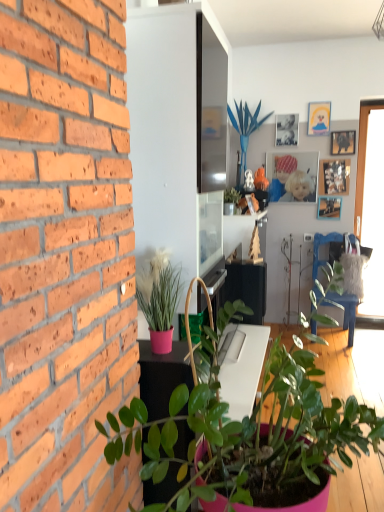
Find the location of a particular element. This screenshot has height=512, width=384. green matte plant at lower center, the first houseplant in the front-to-back sequence is located at coordinates (247, 432).

Measure the distance between green matte plant at lower center, the first houseplant in the front-to-back sequence, and camera.

They are 3.48 feet apart.

How much space does wooden picture frame at upper center, the 4th picture frame positioned from the top, occupy vertically?

The height of wooden picture frame at upper center, the 4th picture frame positioned from the top, is 19.75 inches.

The height and width of the screenshot is (512, 384). What do you see at coordinates (245, 127) in the screenshot?
I see `blue artificial plant at center, placed as the first houseplant when sorted from top to bottom` at bounding box center [245, 127].

Find the location of a particular element. wooden picture frame at upper right, the fourth picture frame in the bottom-to-top sequence is located at coordinates (343, 142).

Where is `green matte plant at lower center, which is the 4th houseplant from back to front`? green matte plant at lower center, which is the 4th houseplant from back to front is located at coordinates (247, 432).

Between wooden picture frame at upper right, the fourth picture frame in the bottom-to-top sequence, and pink matte plant at left, the 2th houseplant when ordered from bottom to top, which one appears on the right side from the viewer's perspective?

wooden picture frame at upper right, the fourth picture frame in the bottom-to-top sequence.

From the picture: Which of these two, wooden picture frame at upper right, the fourth picture frame in the bottom-to-top sequence, or pink matte plant at left, which is the 3th houseplant from back to front, stands shorter?

Standing shorter between the two is wooden picture frame at upper right, the fourth picture frame in the bottom-to-top sequence.

Which object is thinner, wooden picture frame at upper right, which is the third picture frame in top-to-bottom order, or pink matte plant at left, the 3th houseplant from the top?

wooden picture frame at upper right, which is the third picture frame in top-to-bottom order.

From the image's perspective, starting from the pink matte plant at left, which is the 3th houseplant from back to front, which picture frame is the 4th one above? Please provide its 2D coordinates.

[(343, 142)]

Is blue artificial plant at center, acting as the 1th houseplant starting from the back, facing away from matte wooden picture frame at upper right, which is the first picture frame in top-to-bottom order?

No, matte wooden picture frame at upper right, which is the first picture frame in top-to-bottom order, is not at the back of blue artificial plant at center, acting as the 1th houseplant starting from the back.

From the blue artificial plant at center, placed as the first houseplant when sorted from top to bottom, count 2nd picture frames backward and point to it. Please provide its 2D coordinates.

[(319, 118)]

Are blue artificial plant at center, positioned as the fourth houseplant in front-to-back order, and matte wooden picture frame at upper right, the sixth picture frame in the bottom-to-top sequence, far apart?

No.

From the image's perspective, who appears lower, blue artificial plant at center, which appears as the fourth houseplant when ordered from the bottom, or matte wooden picture frame at upper right, the sixth picture frame in the bottom-to-top sequence?

blue artificial plant at center, which appears as the fourth houseplant when ordered from the bottom, is shown below in the image.

How distant is wooden picture frame at upper right, the fourth picture frame in the bottom-to-top sequence, from wooden picture frame at upper center, the 4th picture frame positioned from the top?

wooden picture frame at upper right, the fourth picture frame in the bottom-to-top sequence, is 16.34 inches from wooden picture frame at upper center, the 4th picture frame positioned from the top.

What's the angular difference between wooden picture frame at upper right, the fourth picture frame in the bottom-to-top sequence, and wooden picture frame at upper center, the 4th picture frame positioned from the top,'s facing directions?

0.845 degrees separate the facing orientations of wooden picture frame at upper right, the fourth picture frame in the bottom-to-top sequence, and wooden picture frame at upper center, the 4th picture frame positioned from the top.

Considering the points (354, 143) and (273, 168), which point is behind, point (354, 143) or point (273, 168)?

The point (273, 168) is farther from the camera.

Considering the relative positions of wooden picture frame at upper right, which is the third picture frame in top-to-bottom order, and wooden picture frame at upper center, the 4th picture frame positioned from the top, in the image provided, is wooden picture frame at upper right, which is the third picture frame in top-to-bottom order, to the right of wooden picture frame at upper center, the 4th picture frame positioned from the top, from the viewer's perspective?

Correct, you'll find wooden picture frame at upper right, which is the third picture frame in top-to-bottom order, to the right of wooden picture frame at upper center, the 4th picture frame positioned from the top.

Which picture frame is the 2nd one when counting from the right side of the blue artificial plant at center, placed as the first houseplant when sorted from top to bottom? Please provide its 2D coordinates.

[(292, 176)]

Can you confirm if wooden picture frame at upper center, which is the third picture frame from bottom to top, is wider than blue artificial plant at center, which appears as the fourth houseplant when ordered from the bottom?

In fact, wooden picture frame at upper center, which is the third picture frame from bottom to top, might be narrower than blue artificial plant at center, which appears as the fourth houseplant when ordered from the bottom.

Is wooden picture frame at upper center, which is the third picture frame from bottom to top, oriented towards blue artificial plant at center, positioned as the fourth houseplant in front-to-back order?

No, wooden picture frame at upper center, which is the third picture frame from bottom to top, is not facing towards blue artificial plant at center, positioned as the fourth houseplant in front-to-back order.

Considering their positions, is wooden picture frame at upper center, which is the third picture frame from bottom to top, located in front of or behind blue artificial plant at center, positioned as the fourth houseplant in front-to-back order?

wooden picture frame at upper center, which is the third picture frame from bottom to top, is positioned farther from the viewer than blue artificial plant at center, positioned as the fourth houseplant in front-to-back order.

From the picture: Is green glossy plant at upper center, positioned as the second houseplant in top-to-bottom order, completely or partially outside of blue artificial plant at center, acting as the 1th houseplant starting from the back?

green glossy plant at upper center, positioned as the second houseplant in top-to-bottom order, is positioned outside blue artificial plant at center, acting as the 1th houseplant starting from the back.

Which of these two, green glossy plant at upper center, positioned as the second houseplant in top-to-bottom order, or blue artificial plant at center, placed as the first houseplant when sorted from top to bottom, is thinner?

green glossy plant at upper center, positioned as the second houseplant in top-to-bottom order.

Considering the sizes of objects green glossy plant at upper center, which ranks as the 3th houseplant in bottom-to-top order, and blue artificial plant at center, positioned as the fourth houseplant in front-to-back order, in the image provided, who is bigger, green glossy plant at upper center, which ranks as the 3th houseplant in bottom-to-top order, or blue artificial plant at center, positioned as the fourth houseplant in front-to-back order,?

blue artificial plant at center, positioned as the fourth houseplant in front-to-back order, is bigger.

From a real-world perspective, between green glossy plant at upper center, placed as the 2th houseplant when sorted from back to front, and blue artificial plant at center, which appears as the fourth houseplant when ordered from the bottom, who is vertically higher?

In real-world perspective, blue artificial plant at center, which appears as the fourth houseplant when ordered from the bottom, is above.

Does wooden picture frame at upper right, the fourth picture frame in the bottom-to-top sequence, have a lesser width compared to matte wooden picture frame at upper right, which is the first picture frame in top-to-bottom order?

No, wooden picture frame at upper right, the fourth picture frame in the bottom-to-top sequence, is not thinner than matte wooden picture frame at upper right, which is the first picture frame in top-to-bottom order.

Is wooden picture frame at upper right, which is the third picture frame in top-to-bottom order, not near matte wooden picture frame at upper right, the sixth picture frame in the bottom-to-top sequence?

wooden picture frame at upper right, which is the third picture frame in top-to-bottom order, is near matte wooden picture frame at upper right, the sixth picture frame in the bottom-to-top sequence, not far away.

Which object is positioned more to the right, wooden picture frame at upper right, which is the third picture frame in top-to-bottom order, or matte wooden picture frame at upper right, which is the first picture frame in top-to-bottom order?

wooden picture frame at upper right, which is the third picture frame in top-to-bottom order, is more to the right.

Is pink matte plant at left, the 3th houseplant from the top, far away from wooden picture frame at upper right, which is the third picture frame in top-to-bottom order?

Yes, pink matte plant at left, the 3th houseplant from the top, and wooden picture frame at upper right, which is the third picture frame in top-to-bottom order, are quite far apart.

In the scene shown: Considering the relative positions of pink matte plant at left, which is the 3th houseplant from back to front, and wooden picture frame at upper right, which is the third picture frame in top-to-bottom order, in the image provided, is pink matte plant at left, which is the 3th houseplant from back to front, to the right of wooden picture frame at upper right, which is the third picture frame in top-to-bottom order, from the viewer's perspective?

In fact, pink matte plant at left, which is the 3th houseplant from back to front, is to the left of wooden picture frame at upper right, which is the third picture frame in top-to-bottom order.

In terms of size, does pink matte plant at left, the 3th houseplant from the top, appear bigger or smaller than wooden picture frame at upper right, which is the third picture frame in top-to-bottom order?

Considering their sizes, pink matte plant at left, the 3th houseplant from the top, takes up more space than wooden picture frame at upper right, which is the third picture frame in top-to-bottom order.

Measure the distance between pink matte plant at left, the 2th houseplant when ordered from bottom to top, and wooden picture frame at upper right, the fourth picture frame in the bottom-to-top sequence.

They are 10.28 feet apart.

Where is `houseplant that is the 2nd one below the wooden picture frame at upper right, the fourth picture frame in the bottom-to-top sequence (from a real-world perspective)`? houseplant that is the 2nd one below the wooden picture frame at upper right, the fourth picture frame in the bottom-to-top sequence (from a real-world perspective) is located at coordinates (159, 298).

Identify the location of the 1st houseplant in front of the matte wooden picture frame at upper right, which is the first picture frame in top-to-bottom order. (245, 127).

Considering their positions, is matte silver photo frame at upper center, arranged as the second picture frame when viewed from the top, positioned further to wooden picture frame at upper right, which is counted as the 1th picture frame, starting from the bottom, than green matte plant at lower center, the first houseplant in the front-to-back sequence?

green matte plant at lower center, the first houseplant in the front-to-back sequence.

Which object lies nearer to the anchor point matte wooden picture frame at upper right, which is the first picture frame in top-to-bottom order, blue plastic chair at right or blue artificial plant at center, acting as the 1th houseplant starting from the back?

Based on the image, blue artificial plant at center, acting as the 1th houseplant starting from the back, appears to be nearer to matte wooden picture frame at upper right, which is the first picture frame in top-to-bottom order.

From the picture: From the image, which object appears to be nearer to blue plastic chair at right, pink matte plant at left, which is counted as the 2th houseplant, starting from the front, or green glossy plant at upper center, which is the 3th houseplant in front-to-back order?

Among the two, green glossy plant at upper center, which is the 3th houseplant in front-to-back order, is located nearer to blue plastic chair at right.

When comparing their distances from matte wooden picture frame at upper right, the sixth picture frame in the bottom-to-top sequence, does wooden photo frame at upper right, which appears as the 2th picture frame when ordered from the bottom, or blue artificial plant at center, which appears as the fourth houseplant when ordered from the bottom, seem further?

blue artificial plant at center, which appears as the fourth houseplant when ordered from the bottom, is further to matte wooden picture frame at upper right, the sixth picture frame in the bottom-to-top sequence.

When comparing their distances from wooden picture frame at upper right, which is counted as the 1th picture frame, starting from the bottom, does wooden picture frame at upper right, the fourth picture frame in the bottom-to-top sequence, or blue artificial plant at center, which appears as the fourth houseplant when ordered from the bottom, seem further?

Based on the image, blue artificial plant at center, which appears as the fourth houseplant when ordered from the bottom, appears to be further to wooden picture frame at upper right, which is counted as the 1th picture frame, starting from the bottom.

Looking at the image, which one is located closer to wooden photo frame at upper right, which appears as the 2th picture frame when ordered from the bottom, transparent glass window at right or wooden picture frame at upper center, which is the third picture frame from bottom to top?

wooden picture frame at upper center, which is the third picture frame from bottom to top, is positioned closer to the anchor wooden photo frame at upper right, which appears as the 2th picture frame when ordered from the bottom.

When comparing their distances from wooden picture frame at upper right, the fourth picture frame in the bottom-to-top sequence, does green matte plant at lower center, arranged as the first houseplant when ordered from the bottom, or blue artificial plant at center, positioned as the fourth houseplant in front-to-back order, seem closer?

Based on the image, blue artificial plant at center, positioned as the fourth houseplant in front-to-back order, appears to be nearer to wooden picture frame at upper right, the fourth picture frame in the bottom-to-top sequence.

Which object lies further to the anchor point matte wooden picture frame at upper right, the sixth picture frame in the bottom-to-top sequence, green glossy plant at upper center, placed as the 2th houseplant when sorted from back to front, or matte silver photo frame at upper center, arranged as the second picture frame when viewed from the top?

green glossy plant at upper center, placed as the 2th houseplant when sorted from back to front.

Where is `houseplant between green glossy plant at upper center, placed as the 2th houseplant when sorted from back to front, and wooden picture frame at upper center, the 4th picture frame positioned from the top`? houseplant between green glossy plant at upper center, placed as the 2th houseplant when sorted from back to front, and wooden picture frame at upper center, the 4th picture frame positioned from the top is located at coordinates (245, 127).

Image resolution: width=384 pixels, height=512 pixels. What are the coordinates of `armchair located between green matte plant at lower center, which is the 4th houseplant from back to front, and matte wooden picture frame at upper right, the sixth picture frame in the bottom-to-top sequence, in the depth direction` in the screenshot? It's located at (346, 311).

Image resolution: width=384 pixels, height=512 pixels. Identify the location of houseplant situated between green glossy plant at upper center, which is the 3th houseplant in front-to-back order, and matte wooden picture frame at upper right, which is the first picture frame in top-to-bottom order, from left to right. (245, 127).

Where is `picture frame positioned between pink matte plant at left, which is the 3th houseplant from back to front, and transparent glass window at right from near to far`? The width and height of the screenshot is (384, 512). picture frame positioned between pink matte plant at left, which is the 3th houseplant from back to front, and transparent glass window at right from near to far is located at coordinates point(343,142).